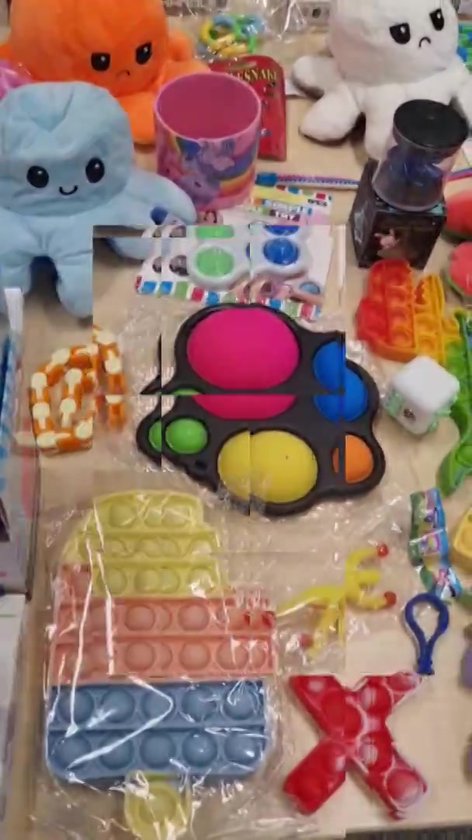
This screenshot has height=840, width=472. In order to click on 1 blue squid stuff animal in this screenshot , I will do `click(70, 135)`.